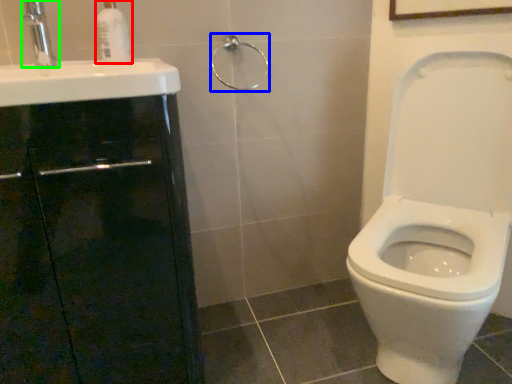
Question: Which is farther away from soap dispenser (highlighted by a red box)? shower (highlighted by a blue box) or tap (highlighted by a green box)?

Choices:
 (A) shower
 (B) tap

Answer: (A)